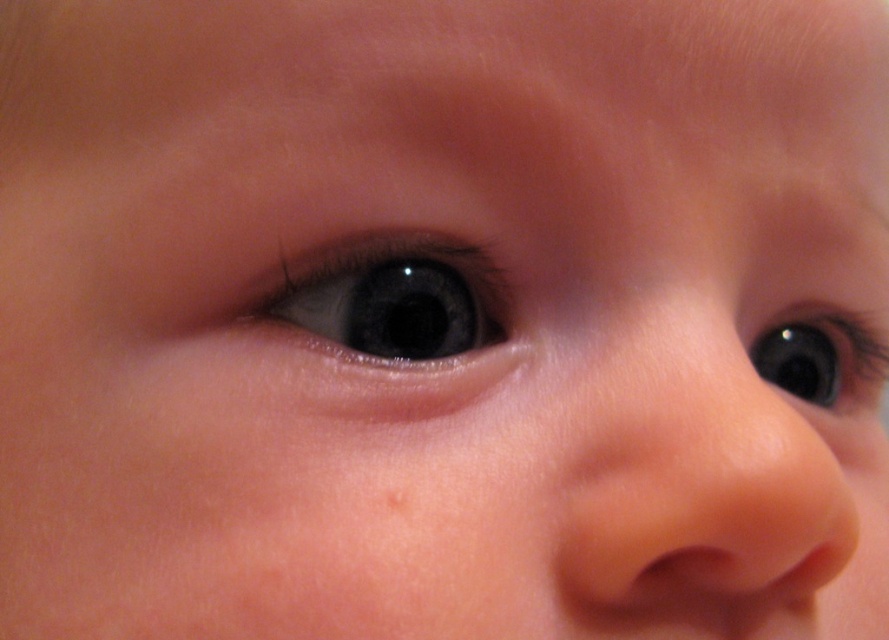
Between smooth flesh-colored nose at center and blue glossy eye at center-left, which one appears on the left side from the viewer's perspective?

From the viewer's perspective, blue glossy eye at center-left appears more on the left side.

Is smooth flesh-colored nose at center bigger than blue glossy eye at center-left?

Indeed, smooth flesh-colored nose at center has a larger size compared to blue glossy eye at center-left.

Where is `smooth flesh-colored nose at center`? smooth flesh-colored nose at center is located at coordinates (719, 490).

Who is higher up, blue glossy eye at center-left or glossy black eye at upper right?

blue glossy eye at center-left is above.

Can you confirm if blue glossy eye at center-left is positioned to the right of glossy black eye at upper right?

Incorrect, blue glossy eye at center-left is not on the right side of glossy black eye at upper right.

Who is more distant from viewer, (436, 292) or (861, 326)?

The point (861, 326) is behind.

Image resolution: width=889 pixels, height=640 pixels. In order to click on blue glossy eye at center-left in this screenshot , I will do `click(388, 305)`.

Does smooth flesh-colored nose at center have a greater height compared to glossy black eye at upper right?

Yes.

Which is behind, point (738, 588) or point (822, 355)?

Positioned behind is point (822, 355).

The image size is (889, 640). I want to click on smooth flesh-colored nose at center, so click(719, 490).